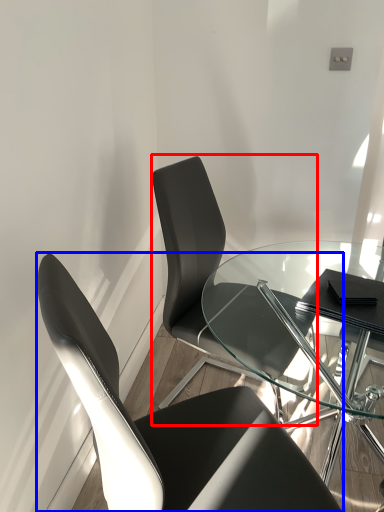
Question: Which object appears closest to the camera in this image, chair (highlighted by a red box) or chair (highlighted by a blue box)?

Choices:
 (A) chair
 (B) chair

Answer: (B)